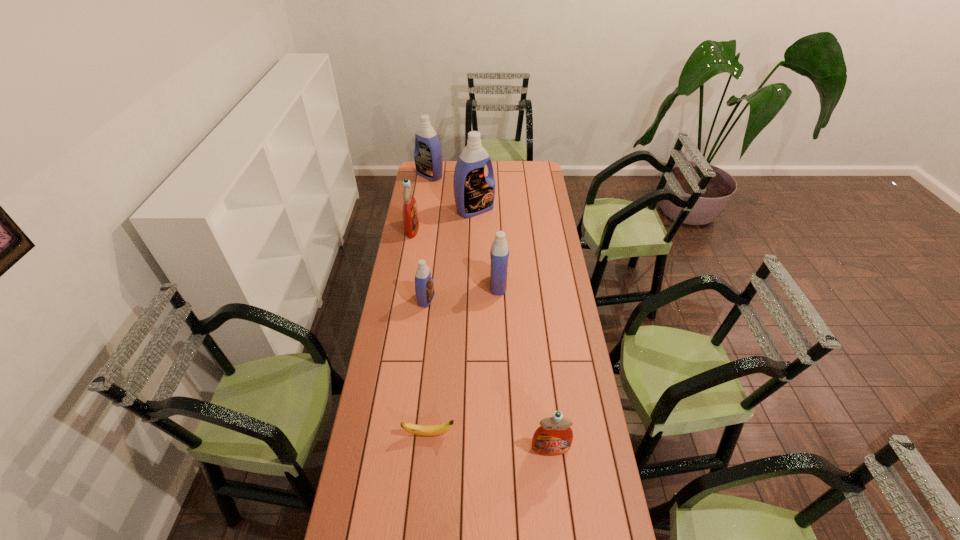
Find the location of a particular element. The width and height of the screenshot is (960, 540). banana situated at the left edge is located at coordinates [x=425, y=430].

Find the location of a particular element. object that is at the right edge is located at coordinates (554, 437).

This screenshot has height=540, width=960. Find the location of `object present at the far left corner`. object present at the far left corner is located at coordinates pos(428,158).

Identify the location of vacant space at the left edge. This screenshot has height=540, width=960. (x=409, y=307).

Identify the location of free region at the right edge. This screenshot has width=960, height=540. (540, 189).

Where is `empty location between the biggest blue detergent and the smaller red detergent`? empty location between the biggest blue detergent and the smaller red detergent is located at coordinates (513, 329).

Where is `vacant point located between the bigger red detergent and the tallest detergent`? Image resolution: width=960 pixels, height=540 pixels. vacant point located between the bigger red detergent and the tallest detergent is located at coordinates 444,219.

Locate an element on the screen. The height and width of the screenshot is (540, 960). free spot between the bigger red detergent and the farthest object is located at coordinates (421, 202).

In order to click on free space between the second biggest blue detergent and the smallest blue detergent in this screenshot , I will do `click(428, 237)`.

This screenshot has height=540, width=960. Find the location of `vacant space that is in between the tallest detergent and the second smallest blue detergent`. vacant space that is in between the tallest detergent and the second smallest blue detergent is located at coordinates (487, 247).